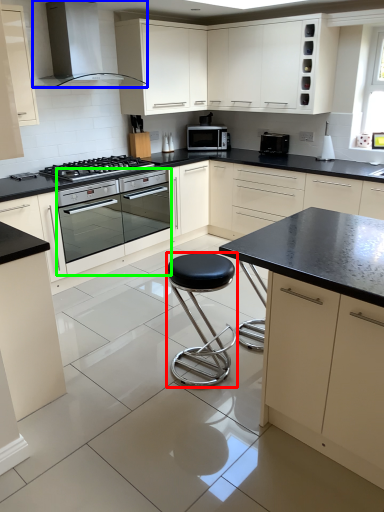
Question: Which object is positioned farthest from stool (highlighted by a red box)? Select from home appliance (highlighted by a blue box) and oven (highlighted by a green box).

Choices:
 (A) home appliance
 (B) oven

Answer: (A)